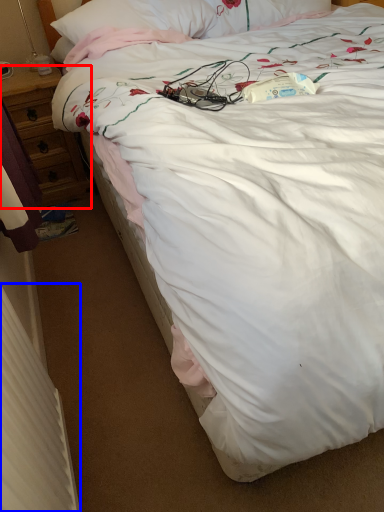
Question: Which object appears closest to the camera in this image, desk (highlighted by a red box) or radiator (highlighted by a blue box)?

Choices:
 (A) desk
 (B) radiator

Answer: (B)